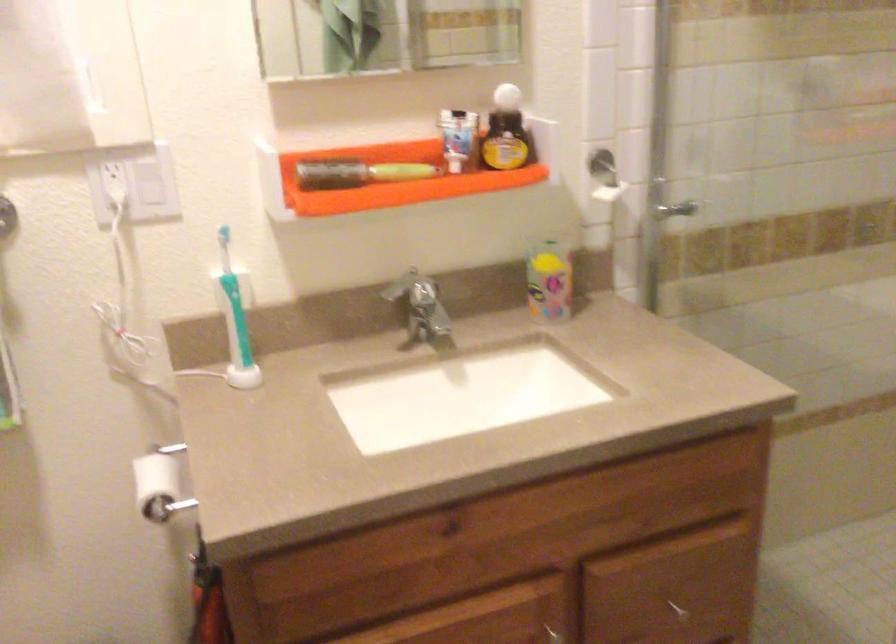
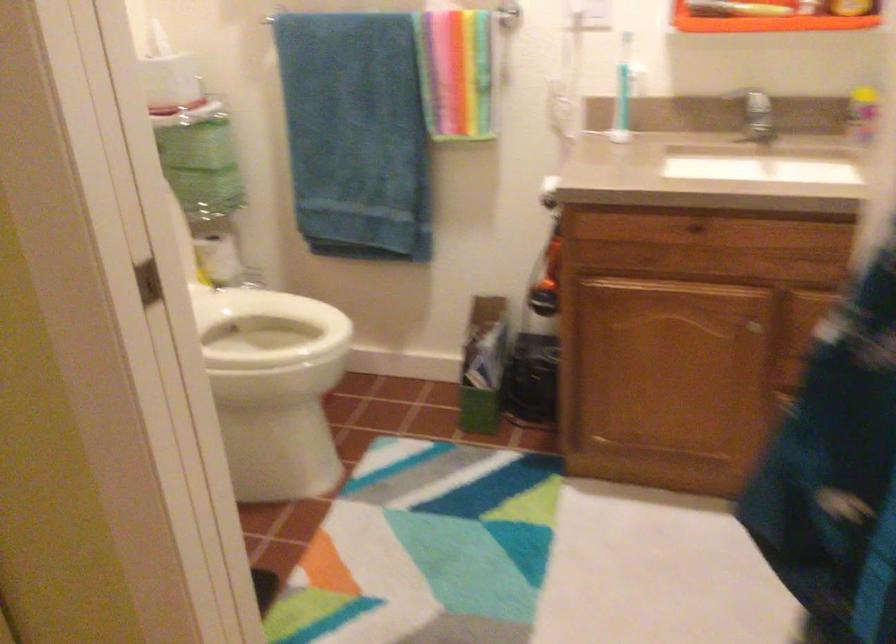
Locate, in the second image, the point that corresponds to the point at 225,314 in the first image.

(623, 91)